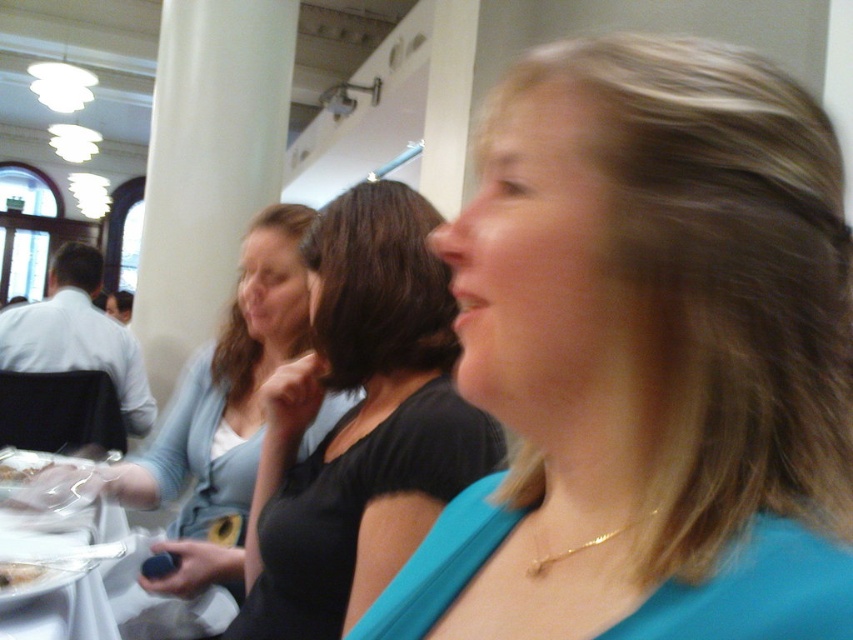
You are organizing a small party and have a blue fabric at center and a white plastic bag at lower left. Which item has a greater width?

The blue fabric at center has a greater width than the white plastic bag at lower left.

You are at a social gathering and notice two items on the table in front of you. They are the clear plastic plate at lower left and the white plastic bag at lower left. Which one is located to the right when viewed from your perspective?

The clear plastic plate at lower left is positioned on the right side of white plastic bag at lower left, so the clear plastic plate at lower left is to the right.